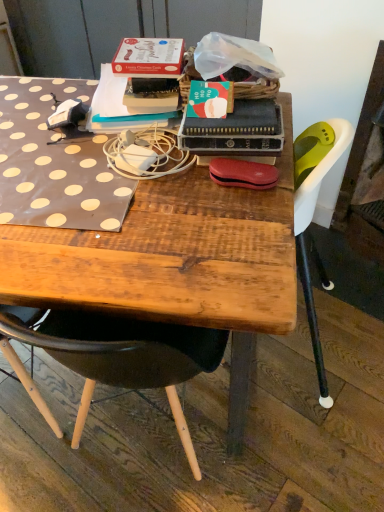
The width and height of the screenshot is (384, 512). I want to click on free region on the left part of white matte charger at center, so click(58, 163).